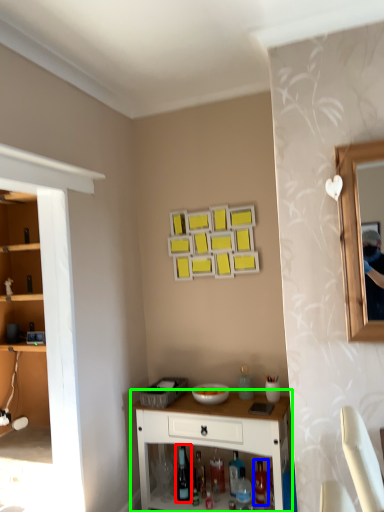
Question: Estimate the real-world distances between objects in this image. Which object is closer to wine bottle (highlighted by a red box), bottle (highlighted by a blue box) or desk (highlighted by a green box)?

Choices:
 (A) bottle
 (B) desk

Answer: (B)